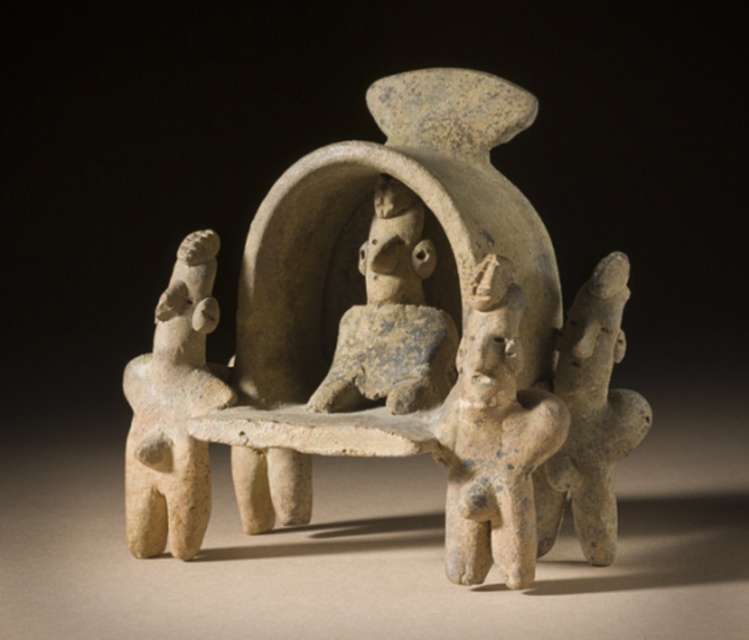
You are an archaeologist examining the sculpture. You need to determine the spatial relationship between the speckled clay figure at center and the gray stone figure at right. Which one is higher in position?

The speckled clay figure at center is positioned over gray stone figure at right, so it is higher in position.